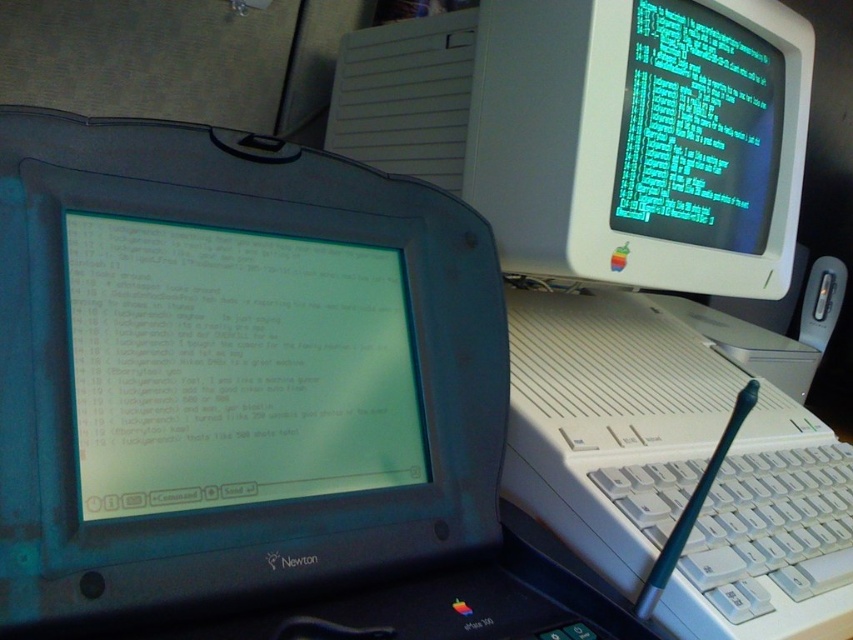
Which of these two, teal plastic newton pda at center or matte plastic screen at center, stands taller?

teal plastic newton pda at center is taller.

Describe the element at coordinates (252, 397) in the screenshot. I see `teal plastic newton pda at center` at that location.

Where is `teal plastic newton pda at center`? This screenshot has width=853, height=640. teal plastic newton pda at center is located at coordinates (252, 397).

Who is shorter, white plastic desktop computer at upper center or white plastic monitor at upper right?

white plastic monitor at upper right

Between white plastic desktop computer at upper center and white plastic monitor at upper right, which one is positioned higher?

white plastic monitor at upper right is above.

Does point (494, 42) come in front of point (585, 115)?

That is False.

What are the coordinates of `white plastic desktop computer at upper center` in the screenshot? It's located at (631, 278).

Is white plastic desktop computer at upper center bigger than matte plastic screen at center?

Yes, white plastic desktop computer at upper center is bigger than matte plastic screen at center.

Find the location of `white plastic desktop computer at upper center`. white plastic desktop computer at upper center is located at coordinates (631, 278).

Who is more distant from viewer, (495, 33) or (189, 401)?

Point (495, 33)

You are a GUI agent. You are given a task and a screenshot of the screen. Output one action in this format:
    pyautogui.click(x=<x>, y=<y>)
    Task: Click on the white plastic desktop computer at upper center
    The image size is (853, 640).
    Given the screenshot: What is the action you would take?
    pyautogui.click(x=631, y=278)